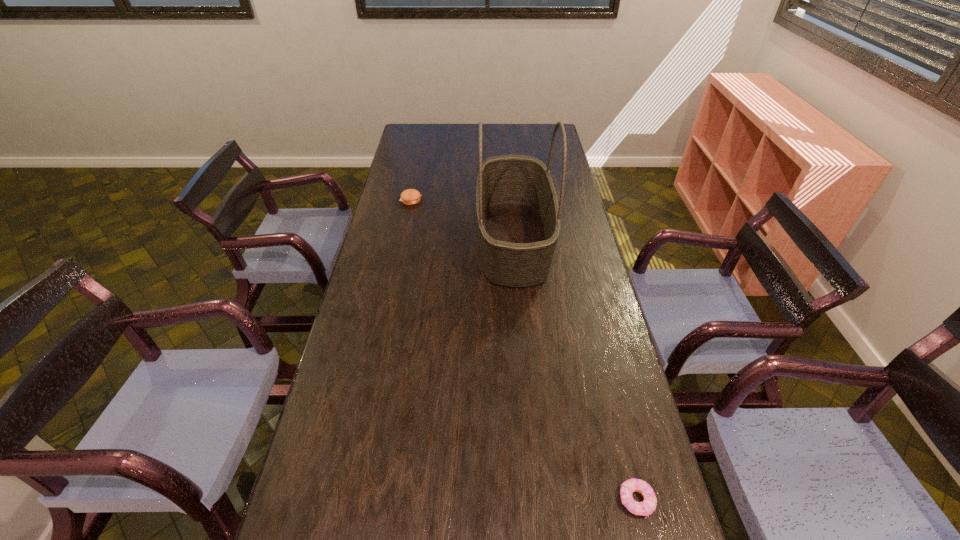
I want to click on basket at the right edge, so click(x=518, y=216).

Find the location of `doughnut at the right edge`. doughnut at the right edge is located at coordinates [x=647, y=507].

Locate an element on the screen. This screenshot has height=540, width=960. free space at the far edge is located at coordinates (507, 131).

In order to click on free region at the left edge of the desktop in this screenshot , I will do `click(374, 242)`.

Find the location of a particular element. Image resolution: width=960 pixels, height=540 pixels. vacant space at the right edge is located at coordinates (643, 474).

In the image, there is a desktop. What are the coordinates of `free space at the far left corner` in the screenshot? It's located at (x=426, y=124).

The height and width of the screenshot is (540, 960). I want to click on free spot between the tallest object and the shortest object, so click(575, 370).

Image resolution: width=960 pixels, height=540 pixels. I want to click on free space between the tallest object and the shortest object, so click(575, 370).

The image size is (960, 540). Find the location of `free space between the patty and the shortest object`. free space between the patty and the shortest object is located at coordinates (523, 350).

Image resolution: width=960 pixels, height=540 pixels. I want to click on empty space that is in between the second object from right to left and the second shortest object, so click(462, 220).